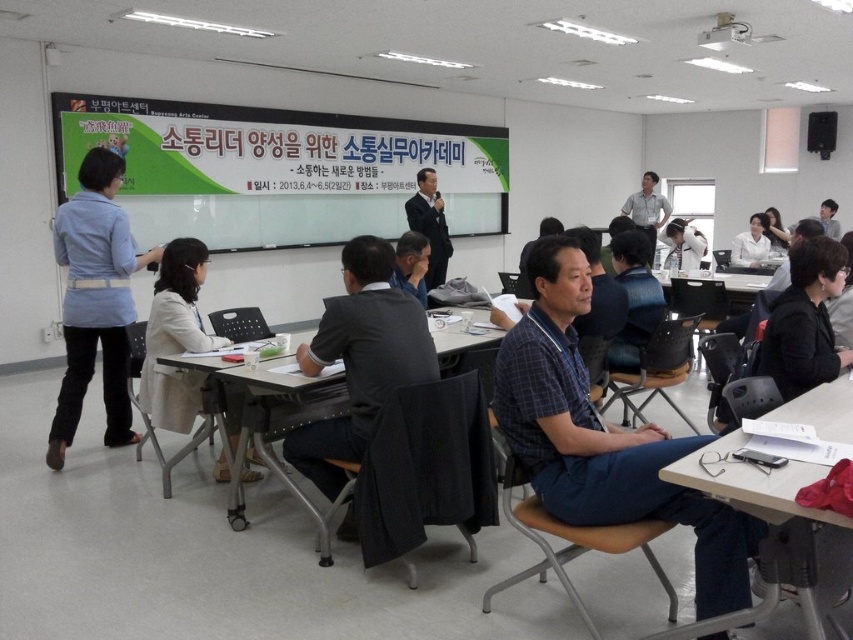
Question: Is the position of dark gray suit at center less distant than that of white plastic table at lower right?

Choices:
 (A) yes
 (B) no

Answer: (B)

Question: Which is nearer to the dark blue shirt at center?

Choices:
 (A) matte gray shirt at center
 (B) light blue shirt at left

Answer: (A)

Question: Can you confirm if white plastic table at lower right is positioned to the right of beige fabric coat at lower left?

Choices:
 (A) yes
 (B) no

Answer: (A)

Question: Which is farther from the white shirt at upper right?

Choices:
 (A) blue plaid shirt at center
 (B) black fabric jacket at lower right
 (C) green matte projection screen at upper center
 (D) matte gray shirt at center

Answer: (A)

Question: Among these objects, which one is farthest from the camera?

Choices:
 (A) white glossy laptop at center
 (B) blue plaid shirt at center
 (C) dark blue shirt at center

Answer: (A)

Question: Does black fabric jacket at lower right appear under light gray shirt at center?

Choices:
 (A) yes
 (B) no

Answer: (A)